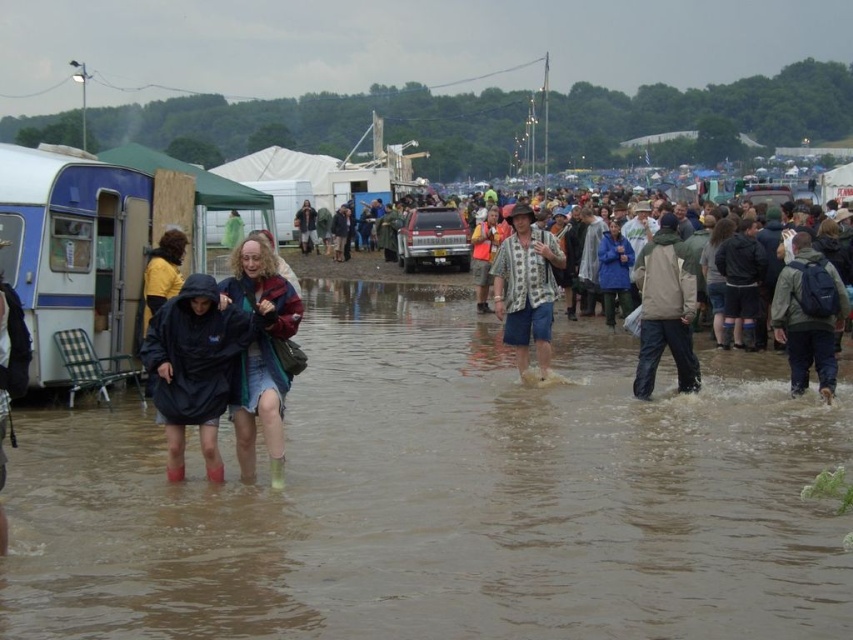
Question: Can you confirm if raincoat fabric at center is bigger than camouflage-patterned shirt at center?

Choices:
 (A) yes
 (B) no

Answer: (B)

Question: Is rubber rain boots at lower left behind raincoat fabric at center?

Choices:
 (A) yes
 (B) no

Answer: (B)

Question: Which point is farther to the camera?

Choices:
 (A) (520, 316)
 (B) (265, 384)
 (C) (381, 269)
 (D) (212, 502)

Answer: (C)

Question: Which object appears farthest from the camera in this image?

Choices:
 (A) brown rubber boots at lower center
 (B) raincoat fabric at center
 (C) camouflage-patterned shirt at center
 (D) dark gray waterproof jacket at right

Answer: (C)

Question: Does rubber rain boots at lower left appear on the left side of dark gray waterproof jacket at right?

Choices:
 (A) no
 (B) yes

Answer: (B)

Question: Estimate the real-world distances between objects in this image. Which object is farther from the camouflage-patterned shirt at center?

Choices:
 (A) patterned fabric shirt at center
 (B) rubber rain boots at lower left
 (C) dark gray waterproof jacket at right
 (D) raincoat fabric at center

Answer: (B)